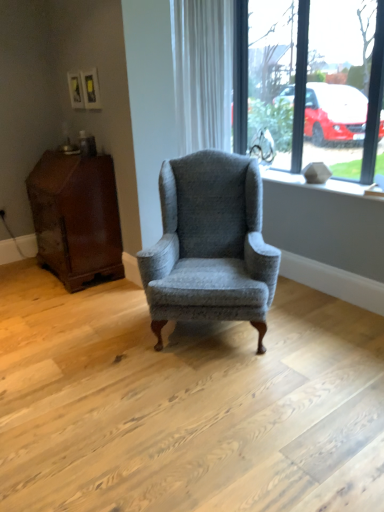
Locate an element on the screen. free space in front of mahogany wood side table at left is located at coordinates (63, 304).